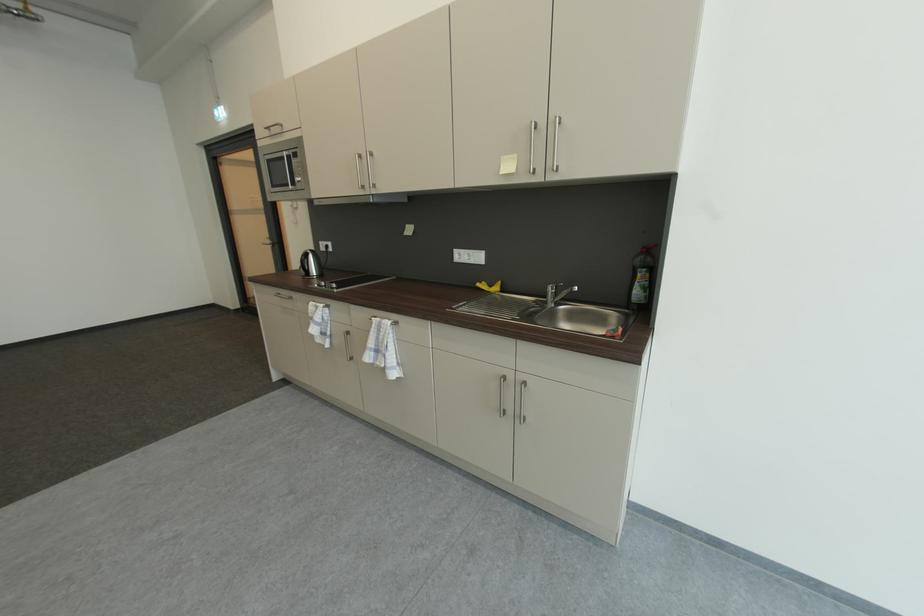
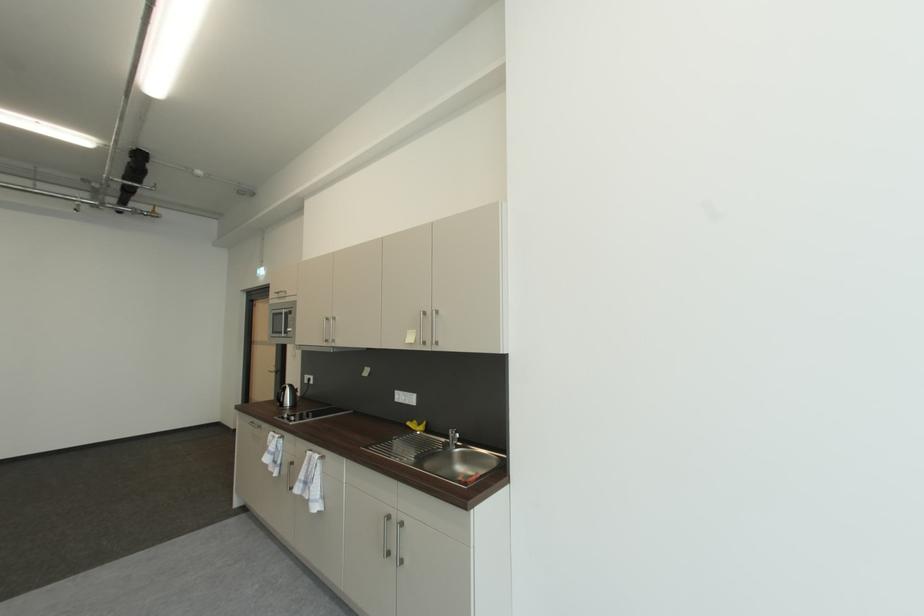
Question: The first image is from the beginning of the video and the second image is from the end. How did the camera likely rotate when shooting the video?

Choices:
 (A) Left
 (B) Right
 (C) Up
 (D) Down

Answer: (C)